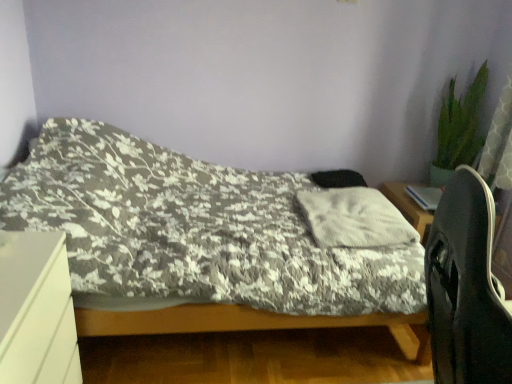
Question: Does fluffy white pillow at center appear on the right side of black matte computer chair at right?

Choices:
 (A) yes
 (B) no

Answer: (B)

Question: Would you consider fluffy white pillow at center to be distant from black matte computer chair at right?

Choices:
 (A) yes
 (B) no

Answer: (A)

Question: Considering the relative sizes of fluffy white pillow at center and black matte computer chair at right in the image provided, is fluffy white pillow at center bigger than black matte computer chair at right?

Choices:
 (A) yes
 (B) no

Answer: (B)

Question: Considering the relative sizes of fluffy white pillow at center and black matte computer chair at right in the image provided, is fluffy white pillow at center smaller than black matte computer chair at right?

Choices:
 (A) no
 (B) yes

Answer: (B)

Question: Is fluffy white pillow at center oriented away from black matte computer chair at right?

Choices:
 (A) yes
 (B) no

Answer: (B)

Question: Would you say green leafy plant at upper right is to the left or to the right of fluffy white pillow at center in the picture?

Choices:
 (A) left
 (B) right

Answer: (B)

Question: Relative to fluffy white pillow at center, is green leafy plant at upper right in front or behind?

Choices:
 (A) front
 (B) behind

Answer: (B)

Question: In terms of height, does green leafy plant at upper right look taller or shorter compared to fluffy white pillow at center?

Choices:
 (A) short
 (B) tall

Answer: (B)

Question: From the image's perspective, is green leafy plant at upper right located above or below fluffy white pillow at center?

Choices:
 (A) below
 (B) above

Answer: (B)

Question: Is point (379, 309) positioned closer to the camera than point (8, 286)?

Choices:
 (A) closer
 (B) farther

Answer: (B)

Question: In terms of height, does fluffy gray blanket at center look taller or shorter compared to white matte desk at lower left?

Choices:
 (A) tall
 (B) short

Answer: (A)

Question: Looking at the image, does fluffy gray blanket at center seem bigger or smaller compared to white matte desk at lower left?

Choices:
 (A) small
 (B) big

Answer: (B)

Question: Looking at their shapes, would you say fluffy gray blanket at center is wider or thinner than white matte desk at lower left?

Choices:
 (A) wide
 (B) thin

Answer: (A)

Question: Would you say fluffy gray blanket at center is to the left or to the right of green leafy plant at upper right in the picture?

Choices:
 (A) right
 (B) left

Answer: (B)

Question: In terms of height, does fluffy gray blanket at center look taller or shorter compared to green leafy plant at upper right?

Choices:
 (A) short
 (B) tall

Answer: (A)